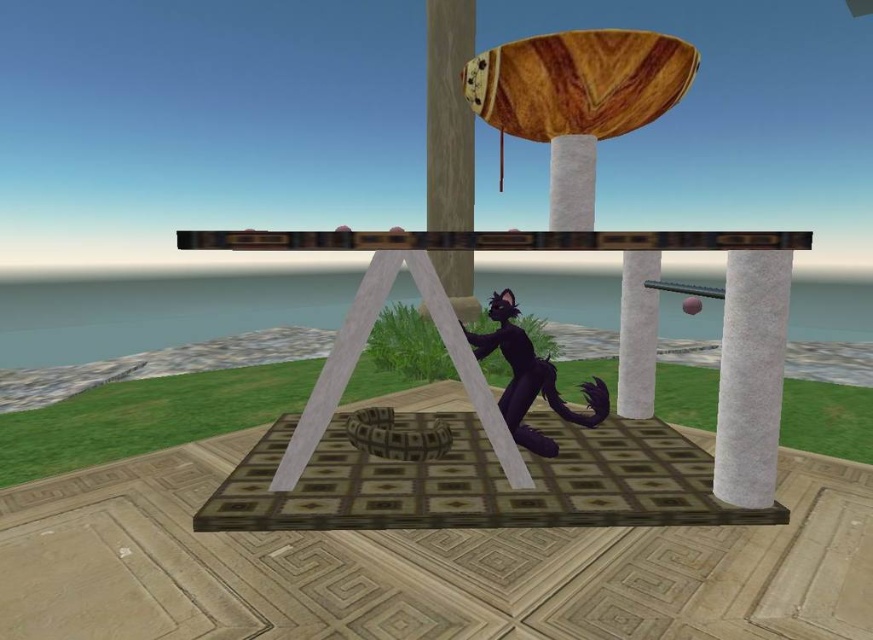
Question: Can you confirm if shiny black cat at center is positioned to the left of wooden pole at center?

Choices:
 (A) yes
 (B) no

Answer: (B)

Question: Which point is closer to the camera?

Choices:
 (A) white marble pillar at center
 (B) white marble pillar at center right
 (C) shiny black cat at center

Answer: (C)

Question: Which of the following is the closest to the observer?

Choices:
 (A) (730, 337)
 (B) (579, 211)

Answer: (A)

Question: Can you confirm if shiny black cat at center is positioned above wooden pole at center?

Choices:
 (A) no
 (B) yes

Answer: (A)

Question: Which point is farther from the camera taking this photo?

Choices:
 (A) (648, 278)
 (B) (459, 184)
 (C) (706, 488)

Answer: (B)

Question: In this image, where is shiny black cat at center located relative to white marble pillar at center?

Choices:
 (A) above
 (B) below

Answer: (B)